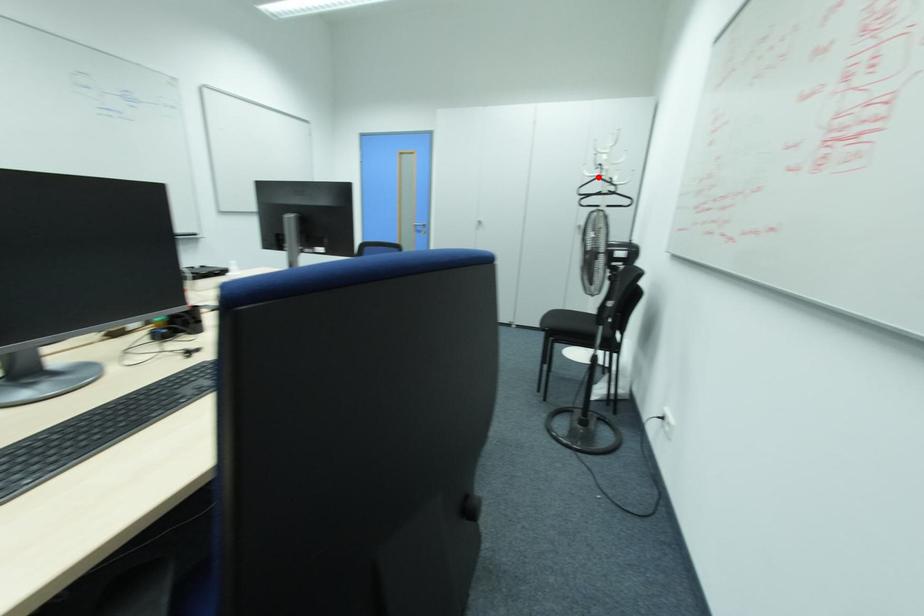
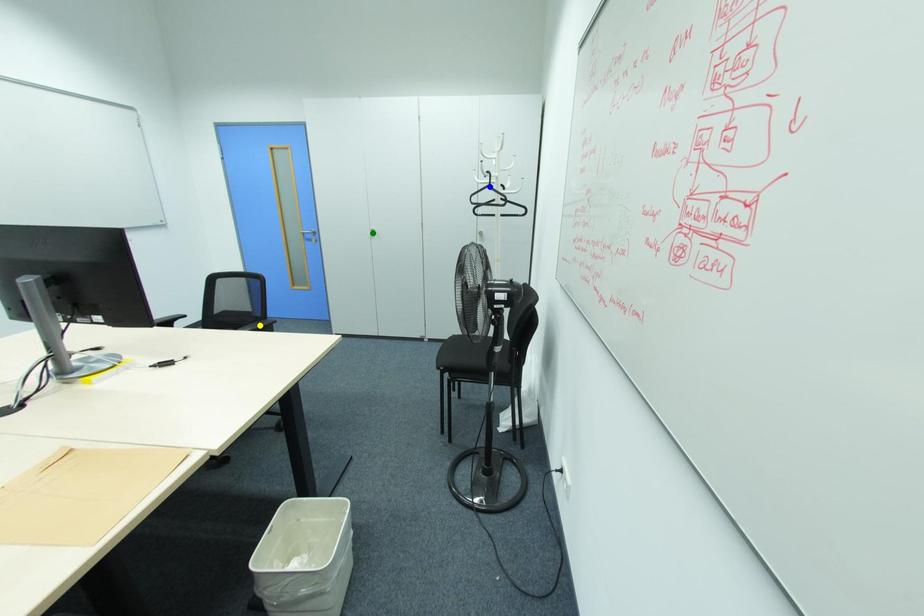
Question: I am providing you with two images of the same scene from different viewpoints. A red point is marked on the first image. You are given multiple points on the second image. In image 2, which mark is for the same physical point as the one in image 1?

Choices:
 (A) green point
 (B) yellow point
 (C) blue point

Answer: (C)